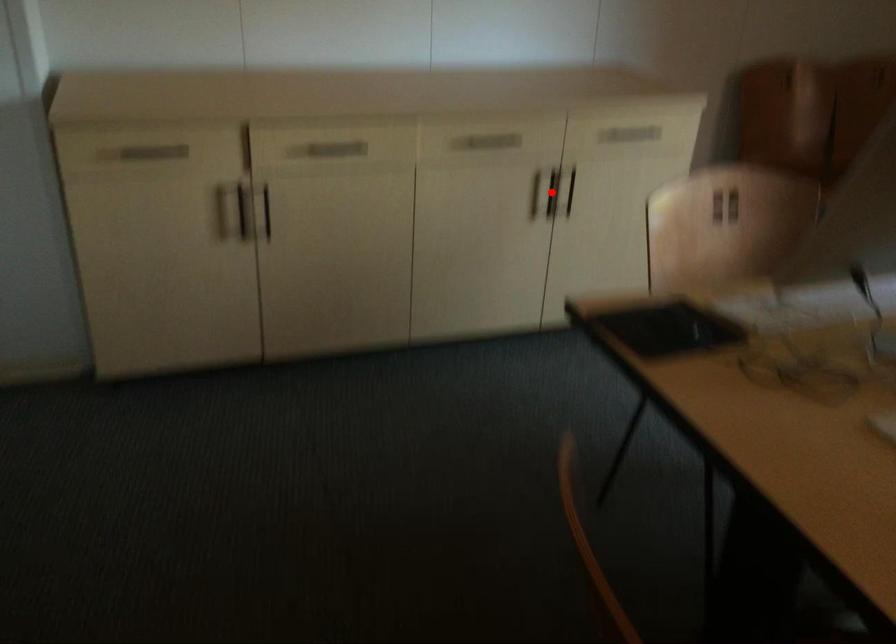
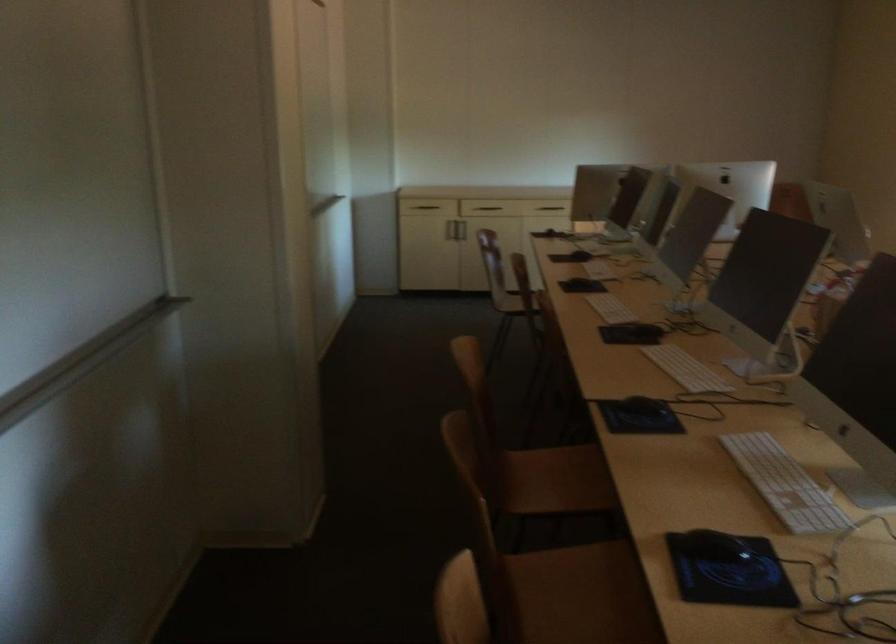
Question: I am providing you with two images of the same scene from different viewpoints. A red point is marked on the first image. At the location where the point appears in image 1, is it still visible in image 2?

Choices:
 (A) Yes
 (B) No

Answer: (B)